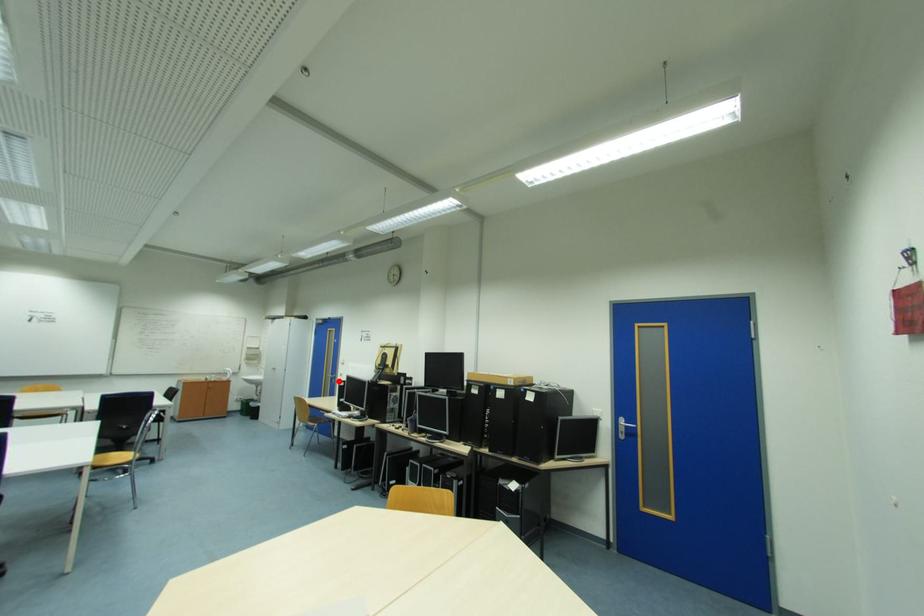
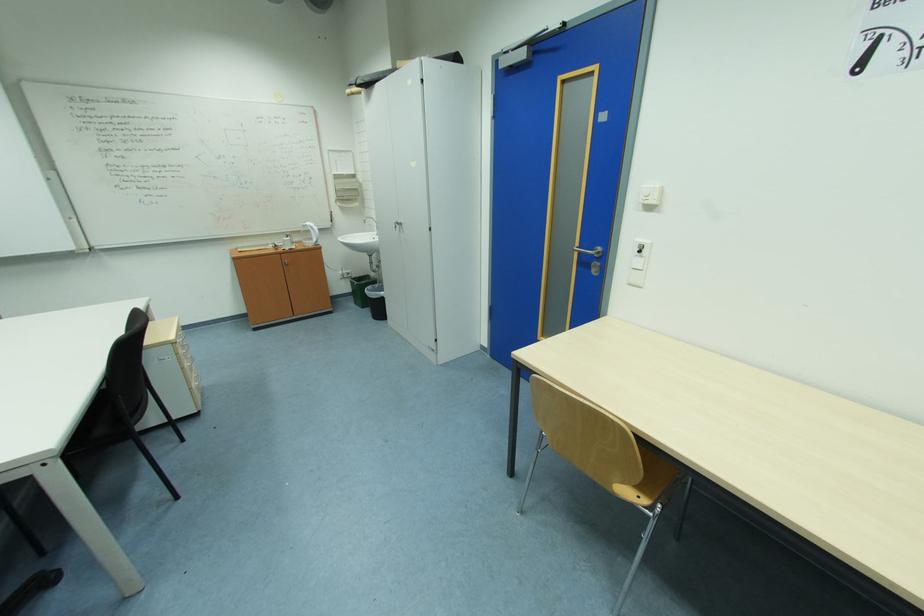
Question: I am providing you with two images of the same scene from different viewpoints. A red point is shown in image1. For the corresponding object point in image2, is it positioned nearer or farther from the camera?

Choices:
 (A) Nearer
 (B) Farther

Answer: (A)